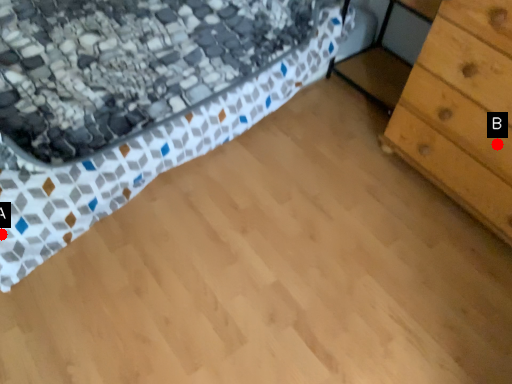
Question: Two points are circled on the image, labeled by A and B beside each circle. Which point is farther to the camera?

Choices:
 (A) A is further
 (B) B is further

Answer: (B)